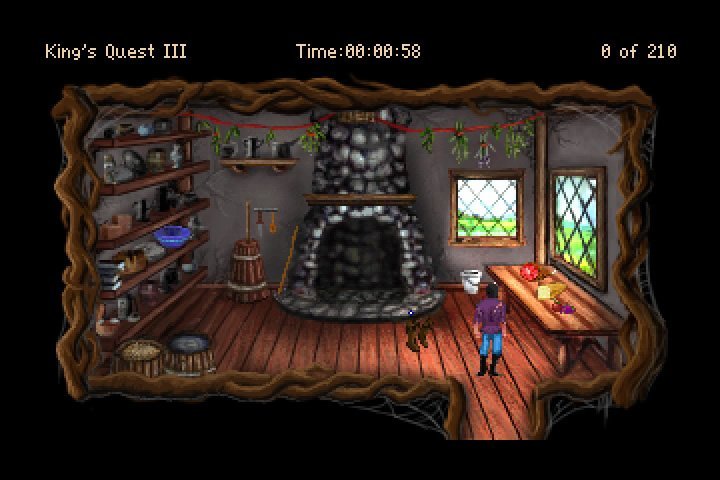
Where is `window frame`? The height and width of the screenshot is (480, 720). window frame is located at coordinates (502, 245), (481, 176), (582, 175), (575, 270).